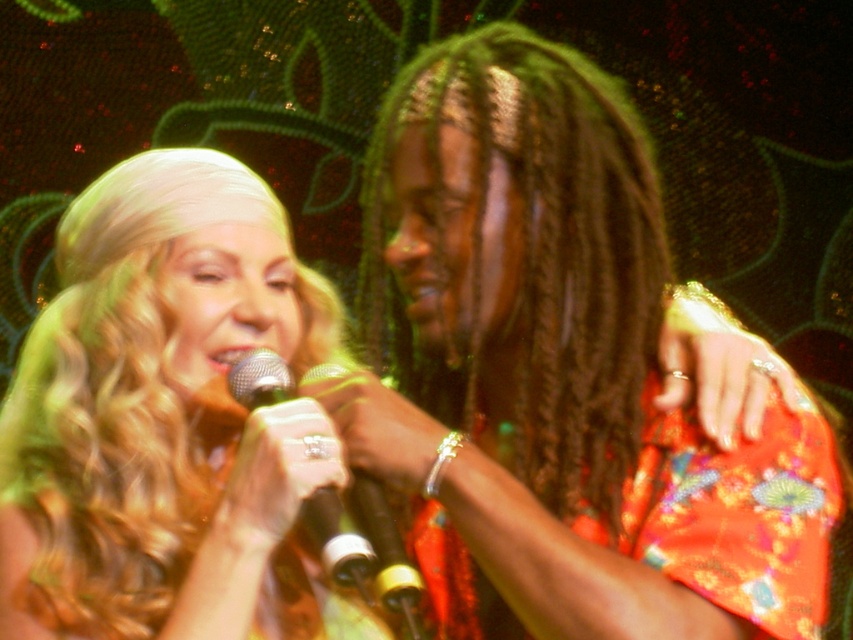
You are a photographer standing behind the two performers. You want to take a photo that captures both the shiny orange dress at center and the dark brown braided hair at center without any overlap between them. Given that your camera has a minimum focus distance of 1.5 inches, will you be able to achieve this?

The shiny orange dress at center and dark brown braided hair at center are 1.30 inches apart, which is less than the camera minimum focus distance of 1.5 inches. Therefore, the camera cannot focus on both objects separately, so you won not be able to capture both without overlap.

You are a photographer trying to capture a closeup shot of the metallic silver microphone at center without the shiny orange dress at center blocking the view. Based on the scene description, can you determine if the microphone is narrow enough to avoid being obscured by the dress?

The shiny orange dress at center is wider than the metallic silver microphone at center, so the microphone is narrow enough to avoid being obscured by the dress.

You are a photographer at the back of the stage. You need to take a photo of both the shiny orange dress at center and the dark brown braided hair at center. Which object should you focus on first to ensure it is in frame?

The shiny orange dress at center is much taller than the dark brown braided hair at center, so you should focus on the shiny orange dress at center first to ensure it is fully in frame.